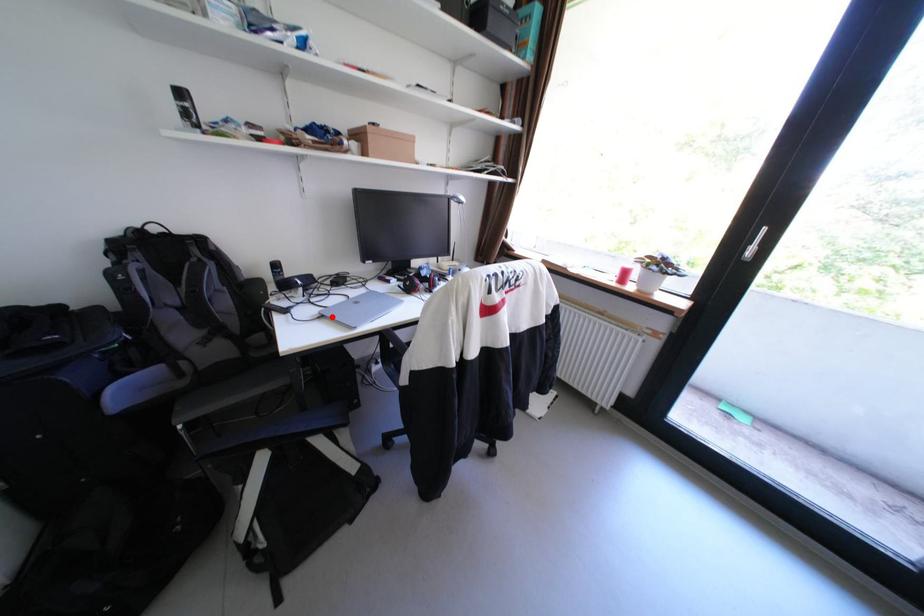
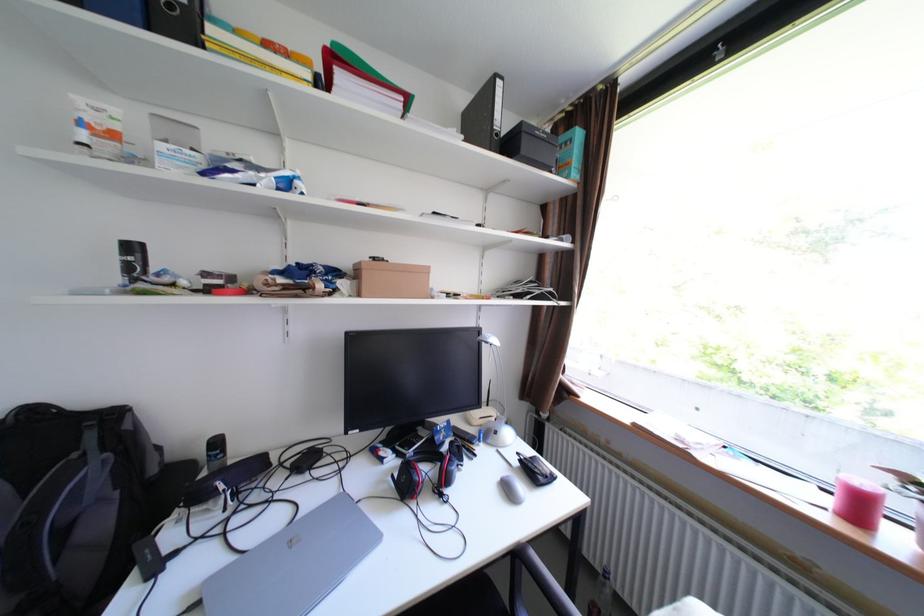
The point at the highlighted location is marked in the first image. Where is the corresponding point in the second image?

(208, 604)